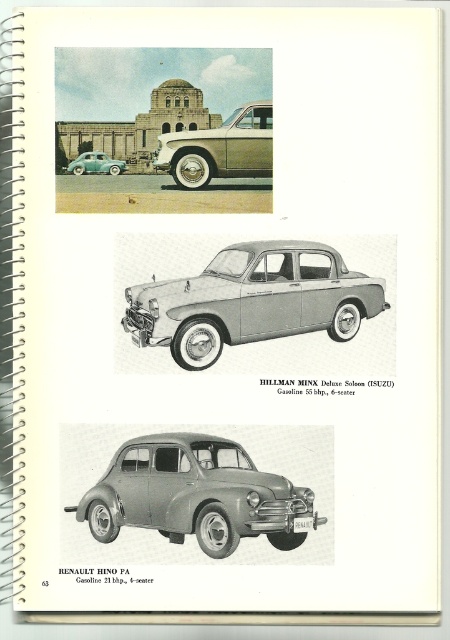
Who is positioned more to the right, matte gray sedan at center or teal glossy sedan at lower left?

matte gray sedan at center

Identify the location of matte gray sedan at center. Image resolution: width=450 pixels, height=640 pixels. (196, 493).

Find the location of a particular element. This screenshot has width=450, height=640. matte gray sedan at center is located at coordinates (196, 493).

Which of these two, silver metallic sedan at center or matte silver sedan at upper center, stands shorter?

matte silver sedan at upper center is shorter.

Does silver metallic sedan at center have a lesser width compared to matte silver sedan at upper center?

No.

Does point (319, 262) come behind point (184, 163)?

Yes, it is.

Where is `silver metallic sedan at center`? This screenshot has width=450, height=640. silver metallic sedan at center is located at coordinates (252, 300).

Can you confirm if silver metallic sedan at center is wider than teal glossy sedan at lower left?

Yes, silver metallic sedan at center is wider than teal glossy sedan at lower left.

Is silver metallic sedan at center in front of teal glossy sedan at lower left?

Yes, silver metallic sedan at center is in front of teal glossy sedan at lower left.

Image resolution: width=450 pixels, height=640 pixels. What do you see at coordinates (252, 300) in the screenshot?
I see `silver metallic sedan at center` at bounding box center [252, 300].

What are the coordinates of `silver metallic sedan at center` in the screenshot? It's located at point(252,300).